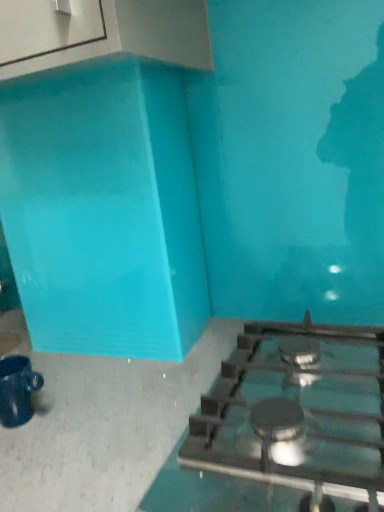
Question: Does matte black mug at lower left have a greater height compared to satin silver gas stove at lower right?

Choices:
 (A) yes
 (B) no

Answer: (A)

Question: Is matte black mug at lower left positioned behind satin silver gas stove at lower right?

Choices:
 (A) yes
 (B) no

Answer: (A)

Question: Can you confirm if matte black mug at lower left is positioned to the left of satin silver gas stove at lower right?

Choices:
 (A) no
 (B) yes

Answer: (B)

Question: From the image's perspective, is matte black mug at lower left on satin silver gas stove at lower right?

Choices:
 (A) no
 (B) yes

Answer: (A)

Question: Is matte black mug at lower left thinner than satin silver gas stove at lower right?

Choices:
 (A) no
 (B) yes

Answer: (B)

Question: Is matte black mug at lower left in contact with satin silver gas stove at lower right?

Choices:
 (A) no
 (B) yes

Answer: (A)

Question: Could matte black mug at lower left be considered to be inside satin silver gas stove at lower right?

Choices:
 (A) no
 (B) yes

Answer: (A)

Question: Is satin silver gas stove at lower right at the right side of matte black mug at lower left?

Choices:
 (A) yes
 (B) no

Answer: (A)

Question: Is satin silver gas stove at lower right turned away from matte black mug at lower left?

Choices:
 (A) yes
 (B) no

Answer: (B)

Question: Is satin silver gas stove at lower right aimed at matte black mug at lower left?

Choices:
 (A) no
 (B) yes

Answer: (A)

Question: Does satin silver gas stove at lower right lie behind matte black mug at lower left?

Choices:
 (A) yes
 (B) no

Answer: (B)

Question: Is satin silver gas stove at lower right outside matte black mug at lower left?

Choices:
 (A) no
 (B) yes

Answer: (B)

Question: Visually, is satin silver gas stove at lower right positioned to the left or to the right of matte black mug at lower left?

Choices:
 (A) right
 (B) left

Answer: (A)